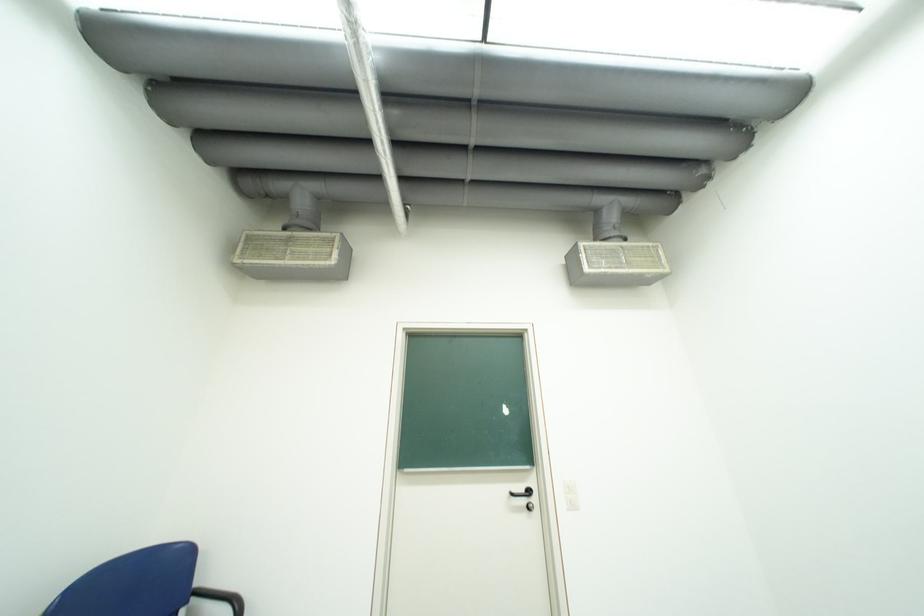
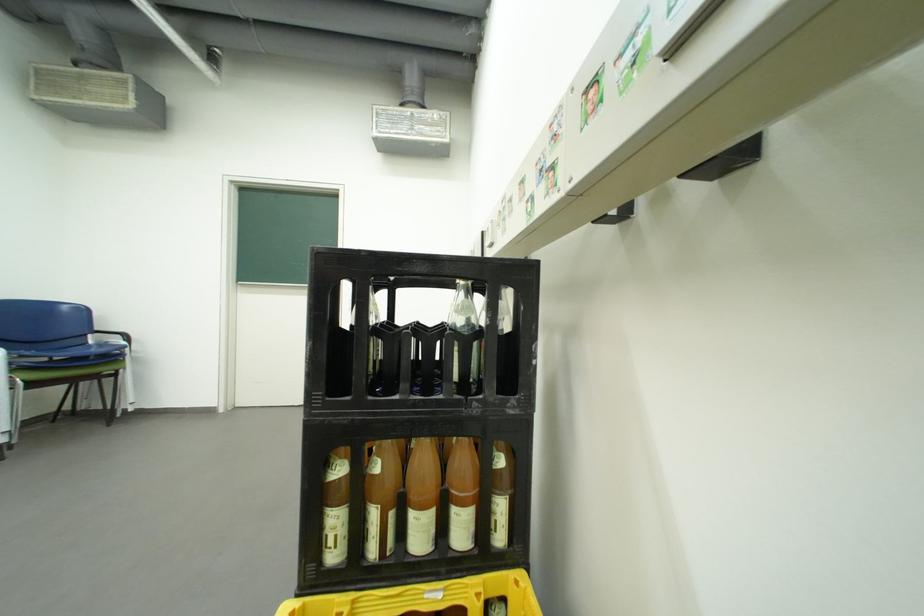
In a continuous first-person perspective shot, in which direction is the camera moving?

The cameraman moved toward right, backward.